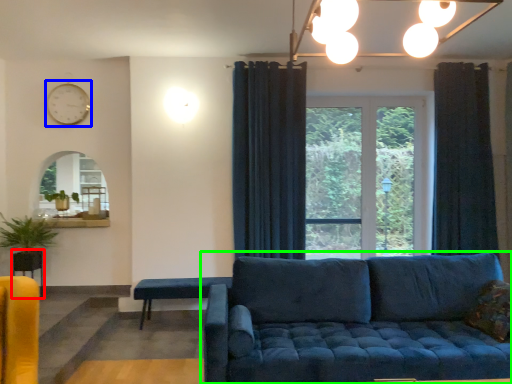
Question: Estimate the real-world distances between objects in this image. Which object is closer to table (highlighted by a red box), clock (highlighted by a blue box) or studio couch (highlighted by a green box)?

Choices:
 (A) clock
 (B) studio couch

Answer: (A)